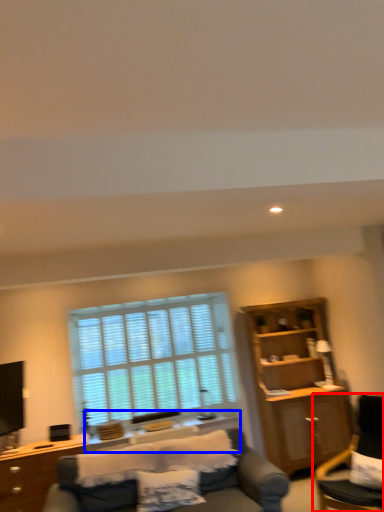
Question: Which of the following is the farthest to the observer, chair (highlighted by a red box) or side table (highlighted by a blue box)?

Choices:
 (A) chair
 (B) side table

Answer: (B)